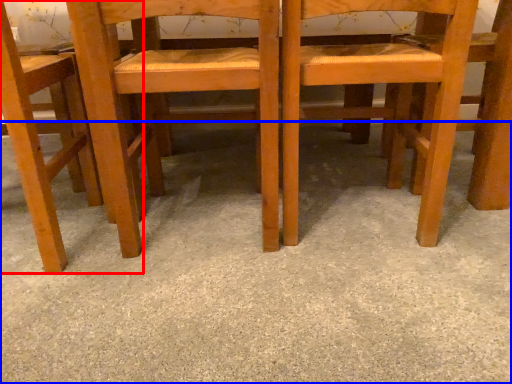
Question: Which of the following is the farthest to the observer, chair (highlighted by a red box) or concrete (highlighted by a blue box)?

Choices:
 (A) chair
 (B) concrete

Answer: (A)